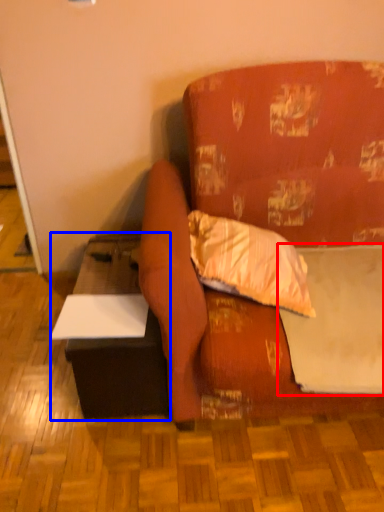
Question: Among these objects, which one is farthest to the camera, sheet (highlighted by a red box) or table (highlighted by a blue box)?

Choices:
 (A) sheet
 (B) table

Answer: (B)